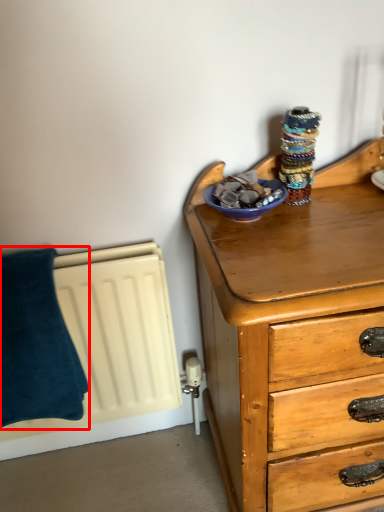
Question: Considering the relative positions of pillow (annotated by the red box) and glass bowl in the image provided, where is pillow (annotated by the red box) located with respect to the staircase?

Choices:
 (A) left
 (B) right

Answer: (A)